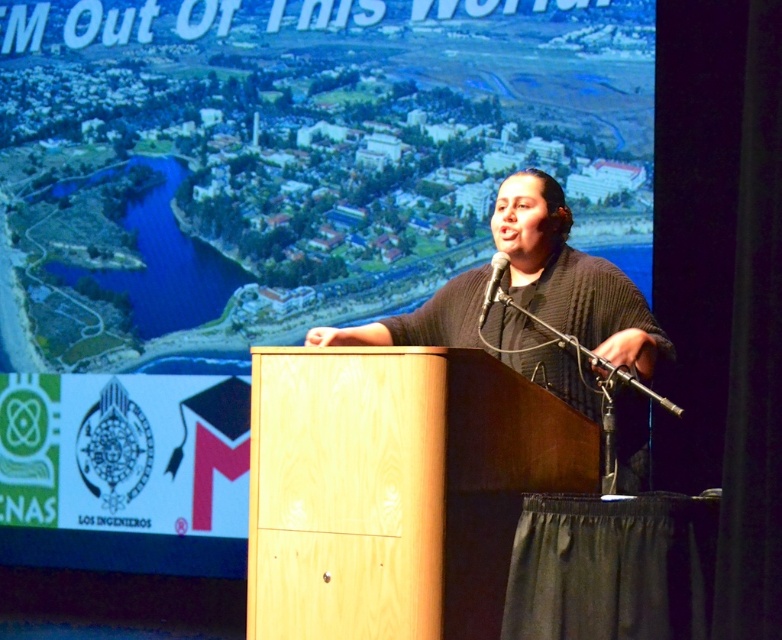
Question: Does black knitted sweater at center have a larger size compared to black matte microphone at center?

Choices:
 (A) no
 (B) yes

Answer: (B)

Question: Which object is closer to the camera taking this photo?

Choices:
 (A) light wood podium at center
 (B) black matte microphone at center
 (C) black knitted sweater at center

Answer: (A)

Question: Which point is closer to the camera taking this photo?

Choices:
 (A) (500, 269)
 (B) (289, 618)

Answer: (B)

Question: Does black knitted sweater at center have a lesser width compared to black matte microphone at center?

Choices:
 (A) yes
 (B) no

Answer: (B)

Question: Can you confirm if light wood podium at center is positioned below black matte microphone at center?

Choices:
 (A) no
 (B) yes

Answer: (B)

Question: Which object is the farthest from the black knitted sweater at center?

Choices:
 (A) light wood podium at center
 (B) black matte microphone at center

Answer: (A)